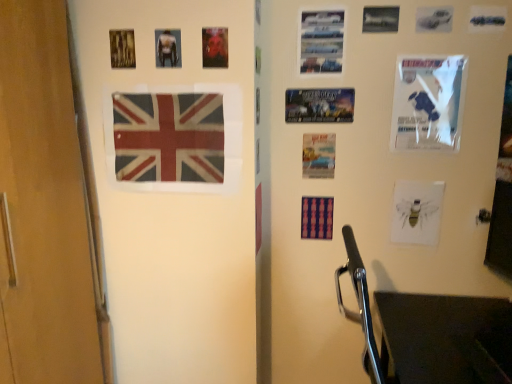
The height and width of the screenshot is (384, 512). What do you see at coordinates (318, 156) in the screenshot?
I see `matte paper poster at center, the sixth poster page viewed from the left` at bounding box center [318, 156].

What do you see at coordinates (428, 102) in the screenshot?
I see `white glossy poster at upper right, the ninth poster page from the left` at bounding box center [428, 102].

What is the approximate height of textured fabric flag at left, positioned as the first flag in left-to-right order?

textured fabric flag at left, positioned as the first flag in left-to-right order, is 15.41 inches tall.

Describe the element at coordinates (319, 105) in the screenshot. I see `metallic silver poster at center, arranged as the 8th poster page when viewed from the right` at that location.

Locate an element on the screen. The width and height of the screenshot is (512, 384). matte paper poster at center, the sixth poster page viewed from the left is located at coordinates (318, 156).

Choose the correct answer: Is metallic silver airplane at upper right, which ranks as the 5th poster page in right-to-left order, inside textured fabric flag at left, which is the 1th flag in front-to-back order, or outside it?

metallic silver airplane at upper right, which ranks as the 5th poster page in right-to-left order, is outside textured fabric flag at left, which is the 1th flag in front-to-back order.

Can you confirm if metallic silver airplane at upper right, which appears as the 7th poster page when viewed from the left, is thinner than textured fabric flag at left, the 1th flag when ordered from top to bottom?

Yes.

Which of these two, metallic silver airplane at upper right, which ranks as the 5th poster page in right-to-left order, or textured fabric flag at left, positioned as the second flag in right-to-left order, stands shorter?

metallic silver airplane at upper right, which ranks as the 5th poster page in right-to-left order, is shorter.

Can you tell me how much metallic silver airplane at upper right, which appears as the 7th poster page when viewed from the left, and textured fabric flag at left, the 1th flag when ordered from top to bottom, differ in facing direction?

The angular difference between metallic silver airplane at upper right, which appears as the 7th poster page when viewed from the left, and textured fabric flag at left, the 1th flag when ordered from top to bottom, is 0.677 degrees.

Between matte plastic flag at center, which is counted as the first flag, starting from the back, and textured fabric flag at left, placed as the second flag when sorted from back to front, which one has larger width?

With larger width is matte plastic flag at center, which is counted as the first flag, starting from the back.

Is matte plastic flag at center, the 2th flag positioned from the left, to the left of textured fabric flag at left, which is the 2th flag from bottom to top, from the viewer's perspective?

In fact, matte plastic flag at center, the 2th flag positioned from the left, is to the right of textured fabric flag at left, which is the 2th flag from bottom to top.

Does matte plastic flag at center, the second flag viewed from the top, contain textured fabric flag at left, which is the 1th flag in front-to-back order?

Actually, textured fabric flag at left, which is the 1th flag in front-to-back order, is outside matte plastic flag at center, the second flag viewed from the top.

Is matte black shirt at upper center, which ranks as the 10th poster page in right-to-left order, inside or outside of metallic silver airplane at upper right, which ranks as the 5th poster page in right-to-left order?

matte black shirt at upper center, which ranks as the 10th poster page in right-to-left order, is not inside metallic silver airplane at upper right, which ranks as the 5th poster page in right-to-left order, it's outside.

Relative to metallic silver airplane at upper right, which ranks as the 5th poster page in right-to-left order, is matte black shirt at upper center, arranged as the 2th poster page when viewed from the left, in front or behind?

Visually, matte black shirt at upper center, arranged as the 2th poster page when viewed from the left, is located in front of metallic silver airplane at upper right, which ranks as the 5th poster page in right-to-left order.

Is matte black shirt at upper center, which ranks as the 10th poster page in right-to-left order, not near metallic silver airplane at upper right, which appears as the 7th poster page when viewed from the left?

Actually, matte black shirt at upper center, which ranks as the 10th poster page in right-to-left order, and metallic silver airplane at upper right, which appears as the 7th poster page when viewed from the left, are a little close together.

From a real-world perspective, is matte black shirt at upper center, which ranks as the 10th poster page in right-to-left order, on metallic silver airplane at upper right, which appears as the 7th poster page when viewed from the left?

Incorrect, from a real-world perspective, matte black shirt at upper center, which ranks as the 10th poster page in right-to-left order, is lower than metallic silver airplane at upper right, which appears as the 7th poster page when viewed from the left.

Is the position of metallic silver car at upper right, arranged as the eleventh poster page when viewed from the left, less distant than that of metallic silver poster at center, which is the fourth poster page in left-to-right order?

Yes, it is.

Is point (487, 18) closer or farther from the camera than point (333, 114)?

Point (487, 18) appears to be closer to the viewer than point (333, 114).

Choose the correct answer: Is metallic silver car at upper right, which ranks as the 1th poster page in right-to-left order, inside metallic silver poster at center, arranged as the 8th poster page when viewed from the right, or outside it?

The correct answer is: outside.

Is metallic silver car at upper right, which ranks as the 1th poster page in right-to-left order, bigger than metallic silver poster at center, arranged as the 8th poster page when viewed from the right?

Incorrect, metallic silver car at upper right, which ranks as the 1th poster page in right-to-left order, is not larger than metallic silver poster at center, arranged as the 8th poster page when viewed from the right.

Looking at their sizes, would you say matte paper bee at lower right, the eighth poster page in the left-to-right sequence, is wider or thinner than matte plastic poster at upper center, the 9th poster page positioned from the right?

matte paper bee at lower right, the eighth poster page in the left-to-right sequence, is thinner than matte plastic poster at upper center, the 9th poster page positioned from the right.

Which object is closer to the camera, matte paper bee at lower right, the eighth poster page in the left-to-right sequence, or matte plastic poster at upper center, the 9th poster page positioned from the right?

matte plastic poster at upper center, the 9th poster page positioned from the right, is in front.

From a real-world perspective, relative to matte plastic poster at upper center, marked as the third poster page in a left-to-right arrangement, is matte paper bee at lower right, the eighth poster page in the left-to-right sequence, vertically above or below?

matte paper bee at lower right, the eighth poster page in the left-to-right sequence, is situated lower than matte plastic poster at upper center, marked as the third poster page in a left-to-right arrangement, in the real world.

Is matte paper bee at lower right, the 4th poster page in the right-to-left sequence, looking in the opposite direction of matte plastic poster at upper center, marked as the third poster page in a left-to-right arrangement?

That's not correct — matte paper bee at lower right, the 4th poster page in the right-to-left sequence, is not looking away from matte plastic poster at upper center, marked as the third poster page in a left-to-right arrangement.

Is point (483, 28) closer to camera compared to point (169, 65)?

No, (483, 28) is further to viewer.

Is metallic silver car at upper right, which ranks as the 1th poster page in right-to-left order, not near matte black shirt at upper center, arranged as the 2th poster page when viewed from the left?

metallic silver car at upper right, which ranks as the 1th poster page in right-to-left order, is positioned a significant distance from matte black shirt at upper center, arranged as the 2th poster page when viewed from the left.

From the image's perspective, is metallic silver car at upper right, which ranks as the 1th poster page in right-to-left order, below matte black shirt at upper center, arranged as the 2th poster page when viewed from the left?

No, from the image's perspective, metallic silver car at upper right, which ranks as the 1th poster page in right-to-left order, is not below matte black shirt at upper center, arranged as the 2th poster page when viewed from the left.

Considering the sizes of objects metallic silver car at upper right, arranged as the eleventh poster page when viewed from the left, and matte black shirt at upper center, which ranks as the 10th poster page in right-to-left order, in the image provided, who is wider, metallic silver car at upper right, arranged as the eleventh poster page when viewed from the left, or matte black shirt at upper center, which ranks as the 10th poster page in right-to-left order,?

With larger width is matte black shirt at upper center, which ranks as the 10th poster page in right-to-left order.

Is metallic silver airplane at upper right, which appears as the 7th poster page when viewed from the left, located outside matte plastic poster at upper center, marked as the third poster page in a left-to-right arrangement?

Yes, metallic silver airplane at upper right, which appears as the 7th poster page when viewed from the left, is not within matte plastic poster at upper center, marked as the third poster page in a left-to-right arrangement.

In the scene shown: Considering the positions of objects metallic silver airplane at upper right, which appears as the 7th poster page when viewed from the left, and matte plastic poster at upper center, marked as the third poster page in a left-to-right arrangement, in the image provided, who is more to the right, metallic silver airplane at upper right, which appears as the 7th poster page when viewed from the left, or matte plastic poster at upper center, marked as the third poster page in a left-to-right arrangement,?

From the viewer's perspective, metallic silver airplane at upper right, which appears as the 7th poster page when viewed from the left, appears more on the right side.

Identify the location of flag in front of the metallic silver airplane at upper right, which ranks as the 5th poster page in right-to-left order. The width and height of the screenshot is (512, 384). (169, 137).

Locate an element on the screen. The image size is (512, 384). flag on the right of textured fabric flag at left, positioned as the first flag in left-to-right order is located at coordinates (317, 218).

From the image, which object appears to be farther from metallic silver poster at center, which is the fourth poster page in left-to-right order, matte plastic poster at upper center, the 9th poster page positioned from the right, or matte black shirt at upper center, which ranks as the 10th poster page in right-to-left order?

matte black shirt at upper center, which ranks as the 10th poster page in right-to-left order, is positioned further to the anchor metallic silver poster at center, which is the fourth poster page in left-to-right order.

Considering their positions, is metallic silver airplane at upper right, which ranks as the 5th poster page in right-to-left order, positioned further to metallic silver poster at center, arranged as the 8th poster page when viewed from the right, than white glossy poster at upper right, the ninth poster page from the left?

Among the two, metallic silver airplane at upper right, which ranks as the 5th poster page in right-to-left order, is located further to metallic silver poster at center, arranged as the 8th poster page when viewed from the right.

When comparing their distances from textured fabric flag at left, positioned as the second flag in right-to-left order, does metallic silver poster at center, which is the fourth poster page in left-to-right order, or white glossy poster at upper right, acting as the second poster page starting from the right, seem further?

The object further to textured fabric flag at left, positioned as the second flag in right-to-left order, is white glossy poster at upper right, acting as the second poster page starting from the right.

Considering their positions, is wooden textured poster at upper left, arranged as the 11th poster page when viewed from the right, positioned closer to white glossy poster at upper right, the tenth poster page viewed from the left, than matte paper poster at center, the sixth poster page viewed from the left?

matte paper poster at center, the sixth poster page viewed from the left, lies closer to white glossy poster at upper right, the tenth poster page viewed from the left, than the other object.

Which object lies further to the anchor point matte plastic flag at center, the 2th flag positioned from the left, metallic silver car at upper right, which ranks as the 1th poster page in right-to-left order, or metallic silver poster at center, which is the fourth poster page in left-to-right order?

metallic silver car at upper right, which ranks as the 1th poster page in right-to-left order, is positioned further to the anchor matte plastic flag at center, the 2th flag positioned from the left.

Estimate the real-world distances between objects in this image. Which object is closer to wooden textured poster at upper left, which is counted as the first poster page, starting from the left, white glossy poster at upper right, the tenth poster page viewed from the left, or matte paper poster at center, placed as the sixth poster page when sorted from right to left?

matte paper poster at center, placed as the sixth poster page when sorted from right to left, is positioned closer to the anchor wooden textured poster at upper left, which is counted as the first poster page, starting from the left.

From the picture: Looking at the image, which one is located closer to matte paper poster at center, the sixth poster page viewed from the left, wooden textured poster at upper left, which is counted as the first poster page, starting from the left, or matte paper bee at lower right, the eighth poster page in the left-to-right sequence?

matte paper bee at lower right, the eighth poster page in the left-to-right sequence, lies closer to matte paper poster at center, the sixth poster page viewed from the left, than the other object.

Looking at the image, which one is located closer to white glossy poster at upper right, the ninth poster page from the left, matte plastic flag at center, the first flag positioned from the bottom, or matte paper bee at lower right, the 4th poster page in the right-to-left sequence?

matte paper bee at lower right, the 4th poster page in the right-to-left sequence, is positioned closer to the anchor white glossy poster at upper right, the ninth poster page from the left.

You are a GUI agent. You are given a task and a screenshot of the screen. Output one action in this format:
    pyautogui.click(x=<x>, y=<y>)
    Task: Click on the flag located between matte plastic poster at upper center, marked as the third poster page in a left-to-right arrangement, and white glossy poster at upper right, which ranks as the third poster page in right-to-left order, in the left-right direction
    The width and height of the screenshot is (512, 384).
    Given the screenshot: What is the action you would take?
    pyautogui.click(x=317, y=218)

This screenshot has width=512, height=384. Find the location of `flag between wooden textured poster at upper left, arranged as the 11th poster page when viewed from the right, and metallic silver cars at upper right, which is the 7th poster page from right to left, in the horizontal direction`. flag between wooden textured poster at upper left, arranged as the 11th poster page when viewed from the right, and metallic silver cars at upper right, which is the 7th poster page from right to left, in the horizontal direction is located at coordinates (169, 137).

Where is `flag between matte black shirt at upper center, which ranks as the 10th poster page in right-to-left order, and metallic silver car at upper right, arranged as the eleventh poster page when viewed from the left`? The width and height of the screenshot is (512, 384). flag between matte black shirt at upper center, which ranks as the 10th poster page in right-to-left order, and metallic silver car at upper right, arranged as the eleventh poster page when viewed from the left is located at coordinates (317, 218).

At what (x,y) coordinates should I click in order to perform the action: click on flag situated between textured fabric flag at left, placed as the second flag when sorted from back to front, and white glossy poster at upper right, the tenth poster page viewed from the left, from left to right. Please return your answer as a coordinate pair (x, y). This screenshot has height=384, width=512. Looking at the image, I should click on (317, 218).